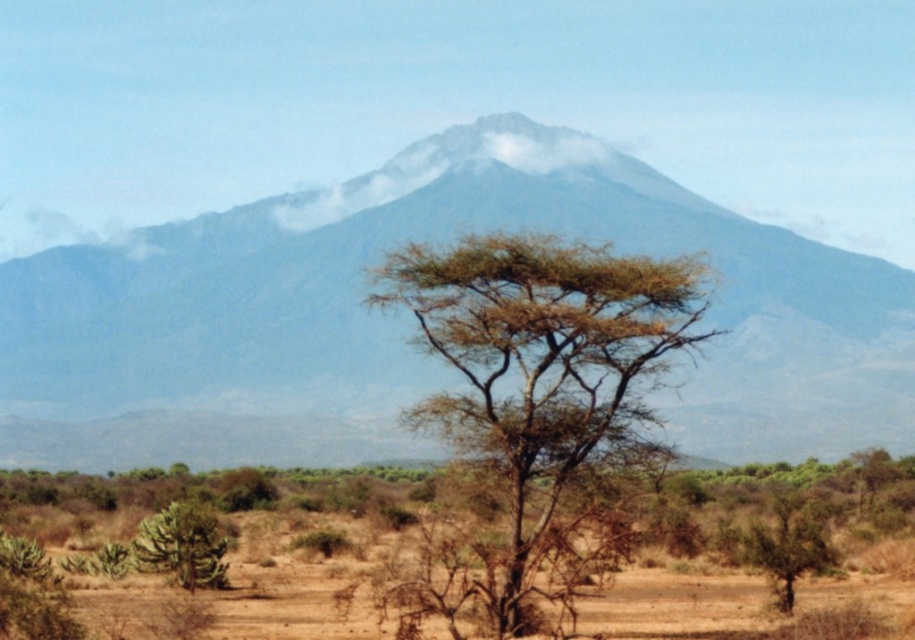
You are a hiker planning to take a photo of the brown rough tree at center and the green spiky bush at lower left. From your current position, which object will appear closer to the top of the photo frame?

The brown rough tree at center will appear closer to the top of the photo frame because it is located above the green spiky bush at lower left.

You are an environmental scientist assessing the biodiversity of the area. You notice the brown rough tree at center and the green spiky bush at lower left. Which of these two plants has a wider spread in terms of its canopy or branches?

The green spiky bush at lower left has a wider spread compared to the brown rough tree at center, as the brown rough tree at center has a lesser width according to the description.